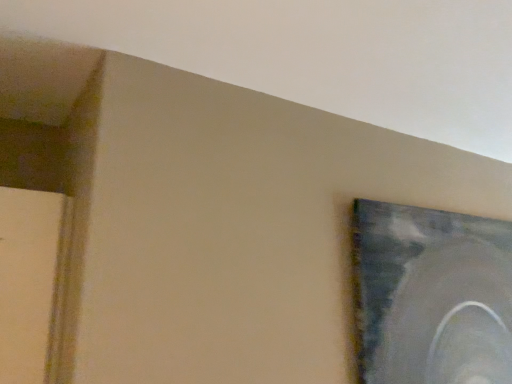
Consider the image. Measure the distance between point (455,328) and camera.

Point (455,328) and camera are 3.92 feet apart from each other.

The height and width of the screenshot is (384, 512). Describe the element at coordinates (432, 296) in the screenshot. I see `metallic silver frame at upper right` at that location.

This screenshot has height=384, width=512. What are the coordinates of `metallic silver frame at upper right` in the screenshot? It's located at (432, 296).

At what (x,y) coordinates should I click in order to perform the action: click on metallic silver frame at upper right. Please return your answer as a coordinate pair (x, y). Image resolution: width=512 pixels, height=384 pixels. Looking at the image, I should click on (432, 296).